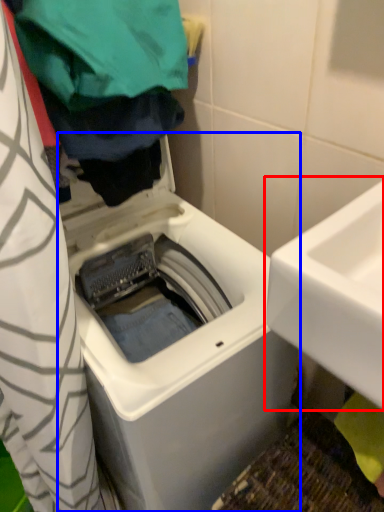
Question: Among these objects, which one is nearest to the camera, sink (highlighted by a red box) or washing machine (highlighted by a blue box)?

Choices:
 (A) sink
 (B) washing machine

Answer: (A)